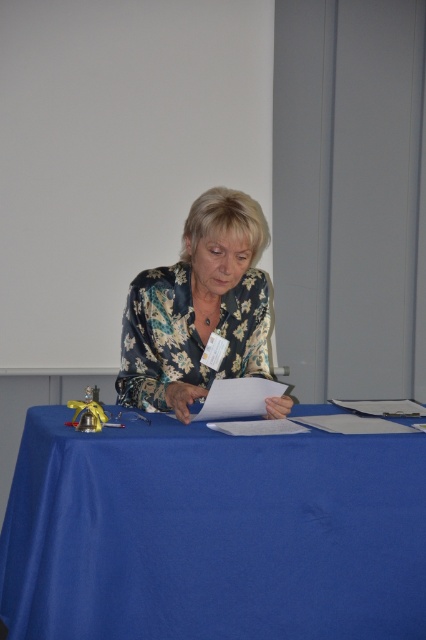
You are the woman in the image. You want to reach for the item located at point [5,620]. Is it closer to you than the item at point [264,346]?

Yes, the item at point [5,620] is closer to you because it is in front of the item at point [264,346].